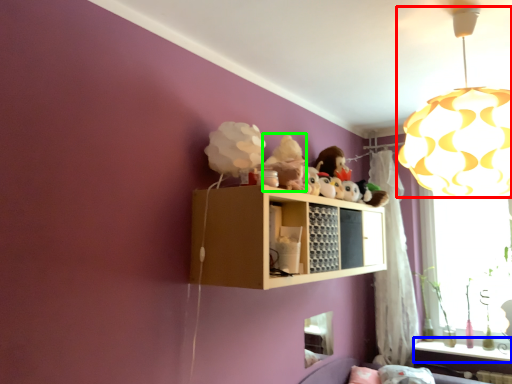
Question: Which is farther away from lamp (highlighted by a red box)? window sill (highlighted by a blue box) or figurine (highlighted by a green box)?

Choices:
 (A) window sill
 (B) figurine

Answer: (A)